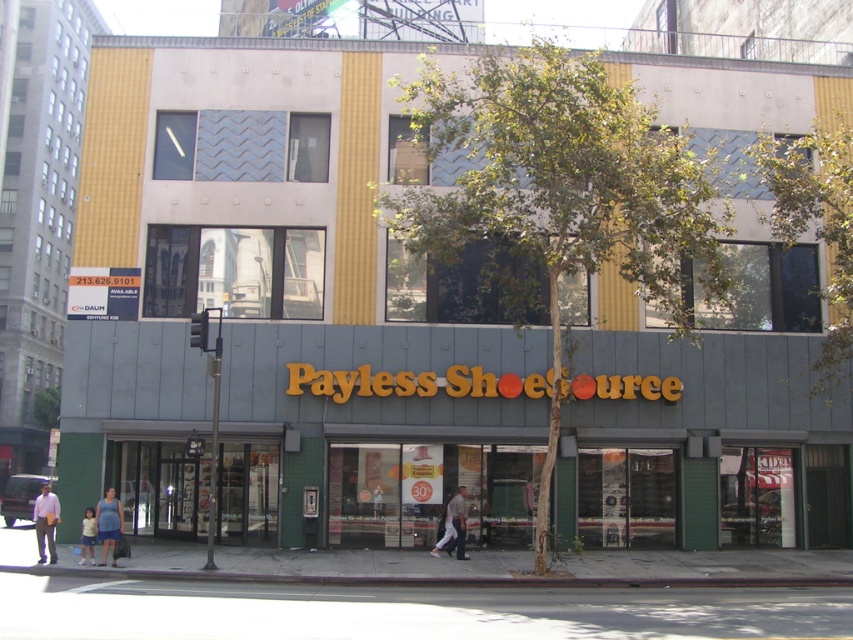
Question: Can you confirm if light purple shirt at center is thinner than light blue denim shorts at lower left?

Choices:
 (A) yes
 (B) no

Answer: (B)

Question: Estimate the real-world distances between objects in this image. Which object is closer to the gray asphalt pavement at lower center?

Choices:
 (A) gray concrete sidewalk at lower center
 (B) light blue denim shorts at lower left

Answer: (A)

Question: Based on their relative distances, which object is nearer to the light blue denim shorts at lower left?

Choices:
 (A) gray asphalt pavement at lower center
 (B) light brown leather jacket at center
 (C) blue denim shorts at lower center

Answer: (C)

Question: Is gray asphalt pavement at lower center above light blue denim shorts at lower left?

Choices:
 (A) yes
 (B) no

Answer: (B)

Question: Which point is farther to the camera?

Choices:
 (A) (448, 532)
 (B) (126, 433)
 (C) (117, 529)
 (D) (561, 612)

Answer: (B)

Question: Is gray asphalt pavement at lower center positioned before light blue denim shorts at lower left?

Choices:
 (A) yes
 (B) no

Answer: (A)